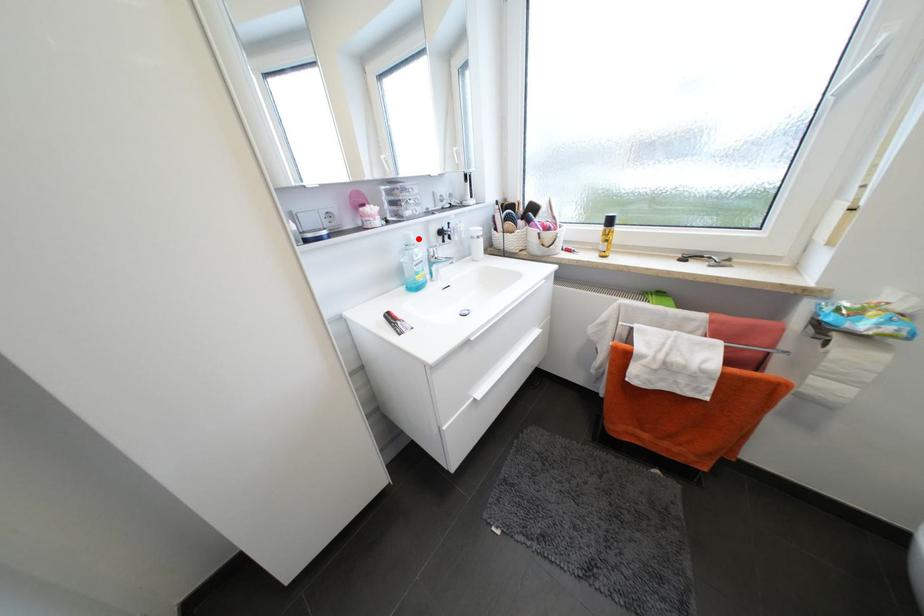
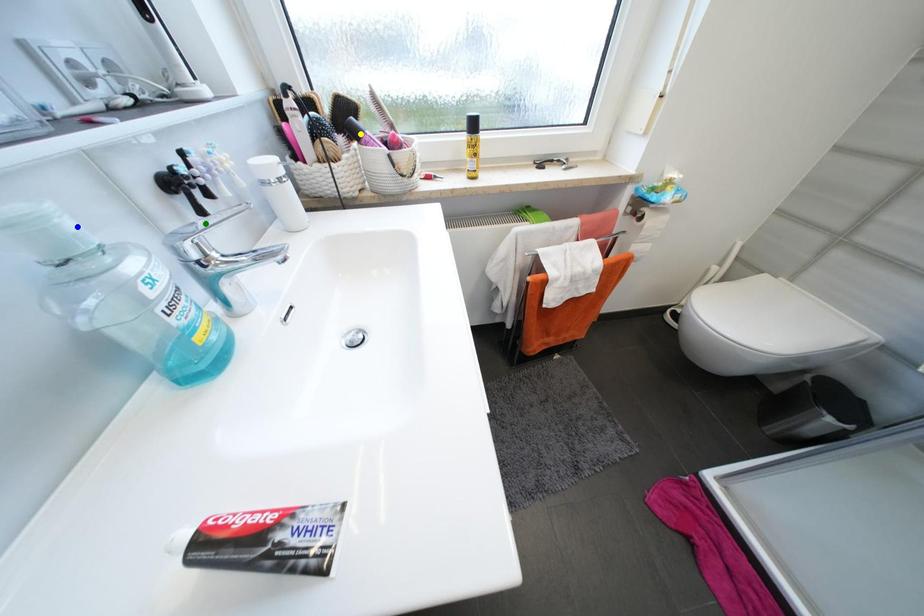
Question: I am providing you with two images of the same scene from different viewpoints. A red point is marked on the first image. You are given multiple points on the second image. Which mark in image 2 goes with the point in image 1?

Choices:
 (A) yellow point
 (B) blue point
 (C) green point

Answer: (B)